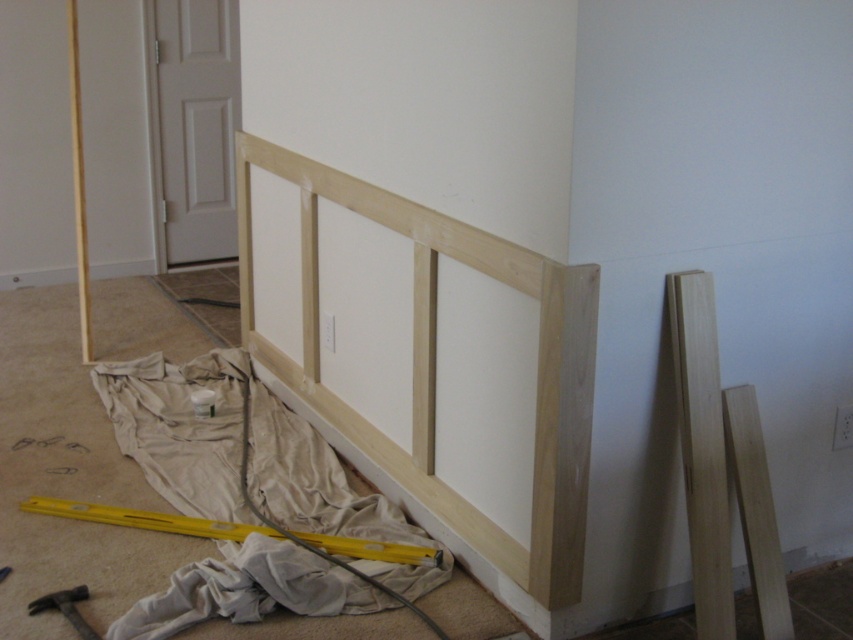
Does yellow wood beam at lower center appear over silver metallic hammer at lower left?

Correct, yellow wood beam at lower center is located above silver metallic hammer at lower left.

Is yellow wood beam at lower center thinner than silver metallic hammer at lower left?

Incorrect, yellow wood beam at lower center's width is not less than silver metallic hammer at lower left's.

Which is behind, point (51, 502) or point (61, 593)?

The point (51, 502) is behind.

This screenshot has height=640, width=853. Identify the location of yellow wood beam at lower center. (233, 531).